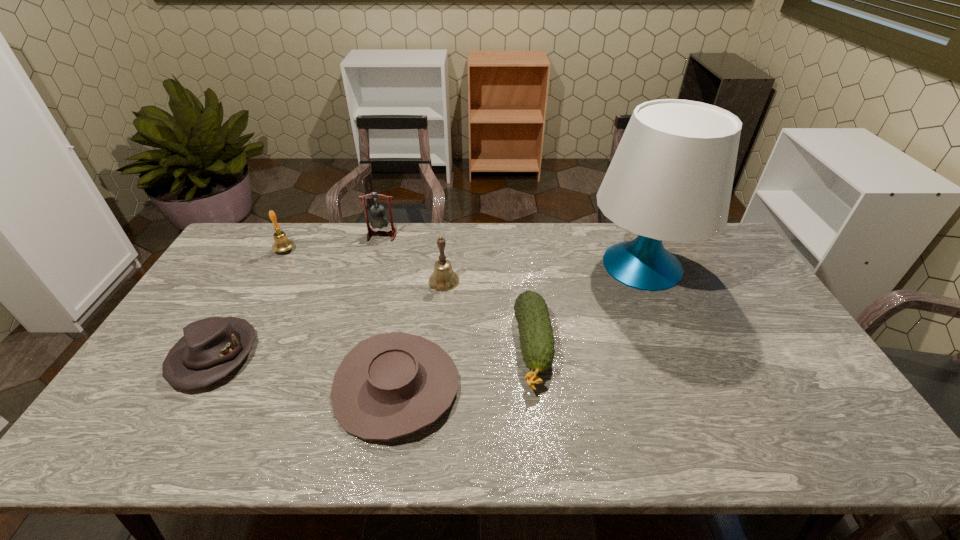
This screenshot has width=960, height=540. I want to click on vacant area that lies between the sixth object from left to right and the tallest object, so click(588, 307).

The height and width of the screenshot is (540, 960). Identify the location of free space between the sixth object from left to right and the tallest object. (588, 307).

Where is `free spot between the nearest bell and the farthest bell`? free spot between the nearest bell and the farthest bell is located at coordinates (413, 258).

This screenshot has height=540, width=960. In order to click on free space that is in between the sixth object from left to right and the second farthest bell in this screenshot , I will do `click(409, 299)`.

Where is `free point between the second bell from right to left and the hat`? The width and height of the screenshot is (960, 540). free point between the second bell from right to left and the hat is located at coordinates (298, 295).

Locate an element on the screen. Image resolution: width=960 pixels, height=540 pixels. unoccupied position between the farthest bell and the hat is located at coordinates (298, 295).

Where is `empty space that is in between the table lamp and the cucumber`? This screenshot has height=540, width=960. empty space that is in between the table lamp and the cucumber is located at coordinates (588, 307).

Identify the location of empty space that is in between the rightmost bell and the hat. The height and width of the screenshot is (540, 960). (329, 318).

Select which object is the closest to the nearest bell. Please provide its 2D coordinates. Your answer should be formatted as a tuple, i.e. [(x, y)], where the tuple contains the x and y coordinates of a point satisfying the conditions above.

[(536, 337)]

Identify which object is the second nearest to the farthest bell. Please provide its 2D coordinates. Your answer should be formatted as a tuple, i.e. [(x, y)], where the tuple contains the x and y coordinates of a point satisfying the conditions above.

[(281, 243)]